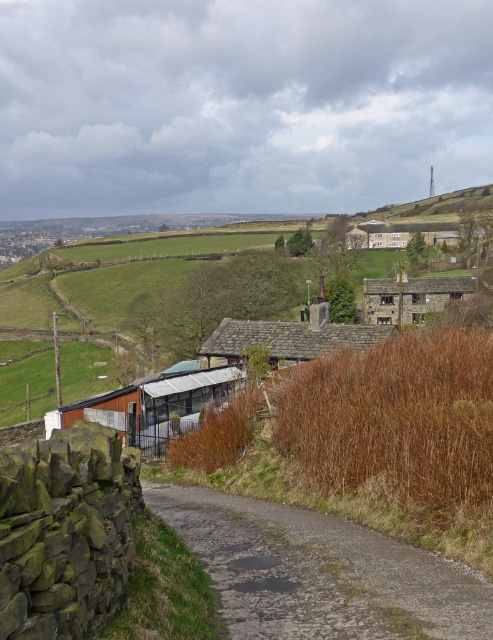
Question: Is gray asphalt road at center bigger than gray slate roof at center?

Choices:
 (A) no
 (B) yes

Answer: (A)

Question: Among these points, which one is farthest from the camera?

Choices:
 (A) (254, 632)
 (B) (387, 308)
 (C) (176, 364)
 (D) (295, 342)

Answer: (B)

Question: Is gray asphalt road at center further to camera compared to gray slate roof at center?

Choices:
 (A) yes
 (B) no

Answer: (B)

Question: Which point is farther from the camera taking this photo?

Choices:
 (A) (236, 365)
 (B) (427, 598)
 (C) (206, 348)

Answer: (C)

Question: Which point is closer to the camera taking this photo?

Choices:
 (A) (176, 371)
 (B) (374, 340)

Answer: (B)

Question: Can you confirm if brown corrugated metal hut at lower center is thinner than gray slate roof at center?

Choices:
 (A) yes
 (B) no

Answer: (A)